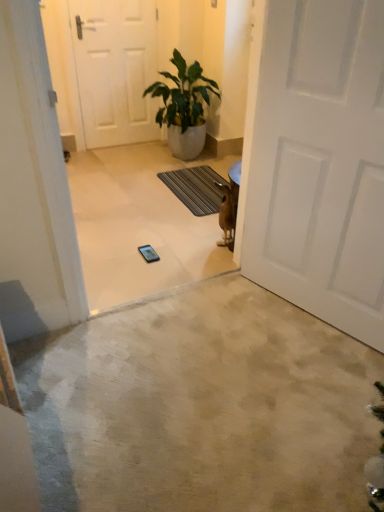
Identify the location of white matte door at upper center, the 1th door viewed from the top. This screenshot has width=384, height=512. (115, 69).

What is the approximate width of white matte door at center, which is the first door from bottom to top?

2.19 inches.

Identify the location of beige carpet at center. The image size is (384, 512). (201, 407).

Where is `white matte door at upper center, arranged as the 2th door when viewed from the right`? white matte door at upper center, arranged as the 2th door when viewed from the right is located at coordinates (115, 69).

Does white matte door at upper center, arranged as the 2th door when viewed from the right, have a lesser width compared to beige carpet at center?

Correct, the width of white matte door at upper center, arranged as the 2th door when viewed from the right, is less than that of beige carpet at center.

From a real-world perspective, does white matte door at upper center, arranged as the 2th door when viewed from the right, stand above beige carpet at center?

Yes, from a real-world perspective, white matte door at upper center, arranged as the 2th door when viewed from the right, is over beige carpet at center

Is point (120, 76) farther from camera compared to point (117, 341)?

Yes, it is behind point (117, 341).

The image size is (384, 512). In order to click on the 2nd door behind when counting from the beige carpet at center in this screenshot , I will do `click(115, 69)`.

Which door is the 1st one when counting from the back of the beige carpet at center? Please provide its 2D coordinates.

[(320, 163)]

In terms of size, does white matte door at center, marked as the first door in a right-to-left arrangement, appear bigger or smaller than beige carpet at center?

In the image, white matte door at center, marked as the first door in a right-to-left arrangement, appears to be larger than beige carpet at center.

In the scene shown: Which of these two, white matte door at center, which is the first door from bottom to top, or beige carpet at center, is thinner?

Thinner between the two is white matte door at center, which is the first door from bottom to top.

Are white matte door at center, marked as the 1th door in a front-to-back arrangement, and beige carpet at center making contact?

white matte door at center, marked as the 1th door in a front-to-back arrangement, is not next to beige carpet at center, and they're not touching.

From a real-world perspective, who is located lower, beige carpet at center or green glossy plant at center?

From a 3D spatial view, beige carpet at center is below.

The width and height of the screenshot is (384, 512). What are the coordinates of `concrete in front of the green glossy plant at center` in the screenshot? It's located at (201, 407).

Is beige carpet at center not close to green glossy plant at center?

Yes, beige carpet at center is far from green glossy plant at center.

Between beige carpet at center and green glossy plant at center, which one has smaller size?

beige carpet at center is smaller.

Between dark gray textured mat at center and beige carpet at center, which one has larger size?

beige carpet at center is bigger.

Considering the relative sizes of dark gray textured mat at center and beige carpet at center in the image provided, is dark gray textured mat at center wider than beige carpet at center?

In fact, dark gray textured mat at center might be narrower than beige carpet at center.

Looking at this image, from the image's perspective, between dark gray textured mat at center and beige carpet at center, who is located below?

beige carpet at center is shown below in the image.

Based on the photo, is dark gray textured mat at center at the back of white matte door at upper center, marked as the first door in a back-to-front arrangement?

No, white matte door at upper center, marked as the first door in a back-to-front arrangement, is not facing the opposite direction of dark gray textured mat at center.

In the scene shown: Considering the sizes of objects white matte door at upper center, the 1th door viewed from the top, and dark gray textured mat at center in the image provided, who is bigger, white matte door at upper center, the 1th door viewed from the top, or dark gray textured mat at center?

white matte door at upper center, the 1th door viewed from the top, is bigger.

In the image, is white matte door at upper center, arranged as the 2th door when viewed from the right, on the left side or the right side of dark gray textured mat at center?

white matte door at upper center, arranged as the 2th door when viewed from the right, is to the left of dark gray textured mat at center.

Considering the sizes of objects dark gray textured mat at center and white matte door at center, the second door in the left-to-right sequence, in the image provided, who is wider, dark gray textured mat at center or white matte door at center, the second door in the left-to-right sequence,?

Wider between the two is dark gray textured mat at center.

How many degrees apart are the facing directions of dark gray textured mat at center and white matte door at center, the 2th door in the top-to-bottom sequence?

The angle between the facing direction of dark gray textured mat at center and the facing direction of white matte door at center, the 2th door in the top-to-bottom sequence, is 21.5 degrees.

You are a GUI agent. You are given a task and a screenshot of the screen. Output one action in this format:
    pyautogui.click(x=<x>, y=<y>)
    Task: Click on the doormat on the left of white matte door at center, which appears as the second door when viewed from the back
    Image resolution: width=384 pixels, height=512 pixels.
    Given the screenshot: What is the action you would take?
    pyautogui.click(x=196, y=188)

From a real-world perspective, who is located higher, dark gray textured mat at center or white matte door at center, marked as the 1th door in a front-to-back arrangement?

white matte door at center, marked as the 1th door in a front-to-back arrangement, from a real-world perspective.

Between point (169, 120) and point (118, 52), which one is positioned behind?

The point (118, 52) is behind.

Looking at this image, from the image's perspective, between green glossy plant at center and white matte door at upper center, acting as the second door starting from the bottom, who is located below?

green glossy plant at center appears lower in the image.

Considering the relative sizes of green glossy plant at center and white matte door at upper center, the 2th door from the front, in the image provided, is green glossy plant at center taller than white matte door at upper center, the 2th door from the front,?

Incorrect, the height of green glossy plant at center is not larger of that of white matte door at upper center, the 2th door from the front.

The height and width of the screenshot is (512, 384). Identify the location of the 1st door directly above the beige carpet at center (from a real-world perspective). (115, 69).

Where is `door to the right of beige carpet at center`? The height and width of the screenshot is (512, 384). door to the right of beige carpet at center is located at coordinates (320, 163).

Based on their spatial positions, is white matte door at upper center, the 2th door from the front, or beige carpet at center further from dark gray textured mat at center?

Based on the image, beige carpet at center appears to be further to dark gray textured mat at center.

Considering their positions, is dark gray textured mat at center positioned further to white matte door at center, the 2th door in the top-to-bottom sequence, than green glossy plant at center?

The object further to white matte door at center, the 2th door in the top-to-bottom sequence, is green glossy plant at center.

Estimate the real-world distances between objects in this image. Which object is closer to white matte door at center, which is the first door from bottom to top, white matte door at upper center, the 2th door from the front, or dark gray textured mat at center?

The object closer to white matte door at center, which is the first door from bottom to top, is dark gray textured mat at center.

Estimate the real-world distances between objects in this image. Which object is closer to beige carpet at center, white matte door at upper center, arranged as the 2th door when viewed from the right, or dark gray textured mat at center?

dark gray textured mat at center is closer to beige carpet at center.

Consider the image. Considering their positions, is white matte door at upper center, the 1th door viewed from the top, positioned further to beige carpet at center than white matte door at center, the second door in the left-to-right sequence?

white matte door at upper center, the 1th door viewed from the top, lies further to beige carpet at center than the other object.

Based on their spatial positions, is white matte door at center, marked as the first door in a right-to-left arrangement, or beige carpet at center further from green glossy plant at center?

beige carpet at center is further to green glossy plant at center.

Looking at the image, which one is located further to green glossy plant at center, beige carpet at center or dark gray textured mat at center?

beige carpet at center lies further to green glossy plant at center than the other object.

Which object lies nearer to the anchor point dark gray textured mat at center, white matte door at center, which is the first door from bottom to top, or white matte door at upper center, arranged as the 2th door when viewed from the right?

The object closer to dark gray textured mat at center is white matte door at upper center, arranged as the 2th door when viewed from the right.

In order to click on doormat between white matte door at center, marked as the 1th door in a front-to-back arrangement, and green glossy plant at center, along the z-axis in this screenshot , I will do `click(196, 188)`.

Image resolution: width=384 pixels, height=512 pixels. Find the location of `doormat between beige carpet at center and green glossy plant at center in the front-back direction`. doormat between beige carpet at center and green glossy plant at center in the front-back direction is located at coordinates (196, 188).

Where is `door between beige carpet at center and white matte door at upper center, arranged as the 2th door when viewed from the right, from front to back`? Image resolution: width=384 pixels, height=512 pixels. door between beige carpet at center and white matte door at upper center, arranged as the 2th door when viewed from the right, from front to back is located at coordinates (320, 163).

Locate an element on the screen. houseplant between white matte door at center, which appears as the second door when viewed from the back, and white matte door at upper center, the 1th door viewed from the top, in the front-back direction is located at coordinates (184, 106).